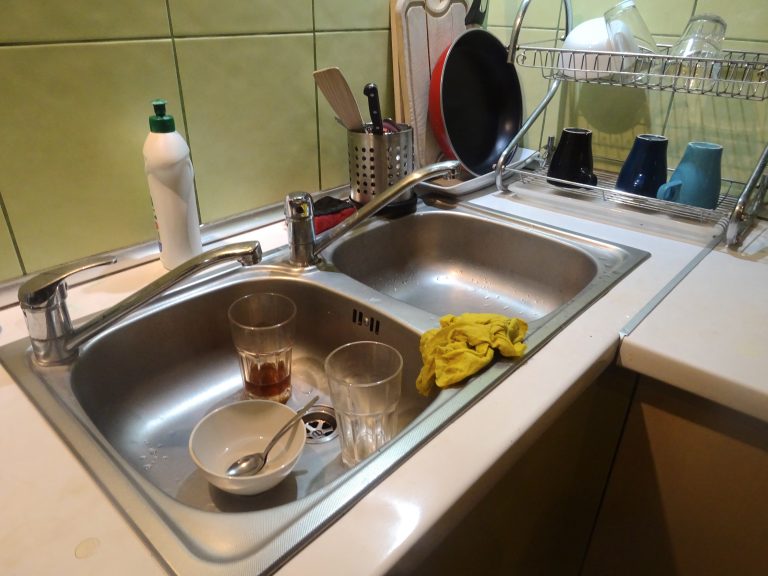
This screenshot has width=768, height=576. What are the coordinates of `spoon` in the screenshot? It's located at (250, 462).